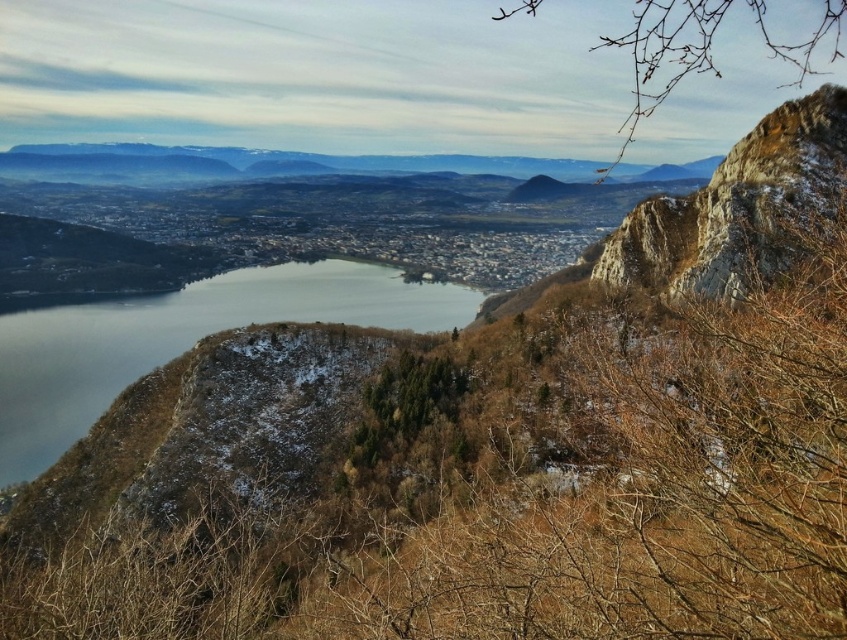
You are an architect designing a new observation deck. You want to ensure visitors can see both the clear glass water at center and the rocky cliff at upper right. Given their sizes, which object will require a wider viewing area to fully capture in the design?

The clear glass water at center requires a wider viewing area because it has a larger size compared to the rocky cliff at upper right.

You are an architect designing a new observation deck. You want to ensure visitors can see both the clear glass water at center and the rocky cliff at upper right. Based on their positions in the image, which object should be placed closer to the left side of the deck to frame the view properly?

The clear glass water at center should be placed closer to the left side of the deck since it is positioned to the left of the rocky cliff at upper right in the image.

You are a drone operator planning to fly a drone from the rocky cliff at upper right to the clear glass water at center. Given that the drone has a maximum flight altitude of 100 meters, will it be able to safely descend without hitting any obstacles?

The clear glass water at center is taller than the rocky cliff at upper right, so the drone can safely descend to the clear glass water at center as it is higher than the rocky cliff at upper right. The altitude difference allows the drone to descend within its flight limit.